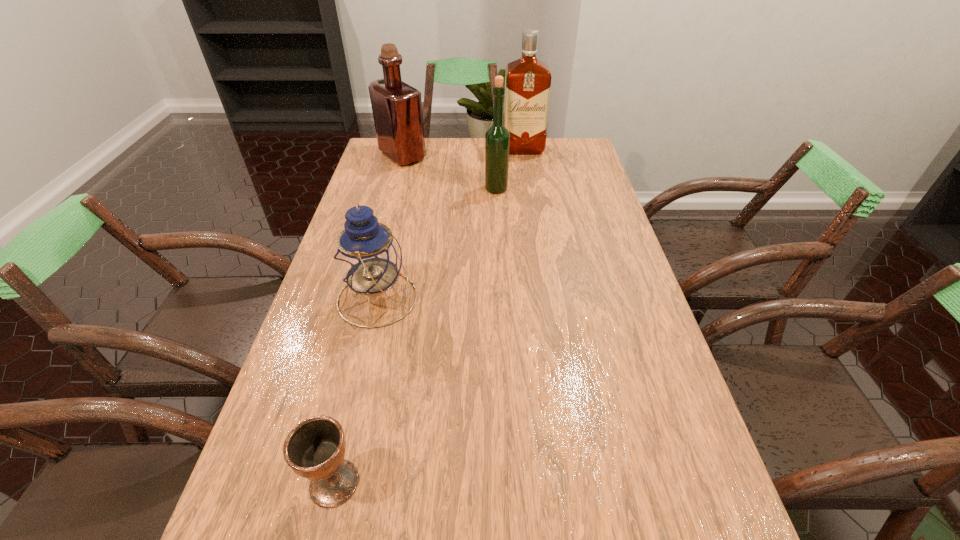
Where is `liquor at the left edge`? Image resolution: width=960 pixels, height=540 pixels. liquor at the left edge is located at coordinates (397, 107).

Where is `lantern at the left edge`? This screenshot has width=960, height=540. lantern at the left edge is located at coordinates (368, 258).

Where is `chalice present at the left edge`? The width and height of the screenshot is (960, 540). chalice present at the left edge is located at coordinates (315, 448).

Identify the location of object present at the far left corner. The width and height of the screenshot is (960, 540). (x=397, y=107).

You are a GUI agent. You are given a task and a screenshot of the screen. Output one action in this format:
    pyautogui.click(x=<x>, y=<y>)
    Task: Click on the vacant position at the far edge of the desktop
    The image size is (960, 540).
    Given the screenshot: What is the action you would take?
    pyautogui.click(x=463, y=146)

This screenshot has height=540, width=960. Identify the location of vacant space at the left edge of the desktop. (279, 534).

Where is `vacant area at the right edge of the desktop`? vacant area at the right edge of the desktop is located at coordinates (613, 327).

The image size is (960, 540). I want to click on free spot between the leftmost liquor and the nearest liquor, so click(449, 172).

At what (x,y) coordinates should I click in order to perform the action: click on free space between the shortest object and the leftmost liquor. Please return your answer as a coordinate pair (x, y). Looking at the image, I should click on (369, 319).

Locate an element on the screen. This screenshot has width=960, height=540. object that stands as the fourth closest to the nearest liquor is located at coordinates (315, 448).